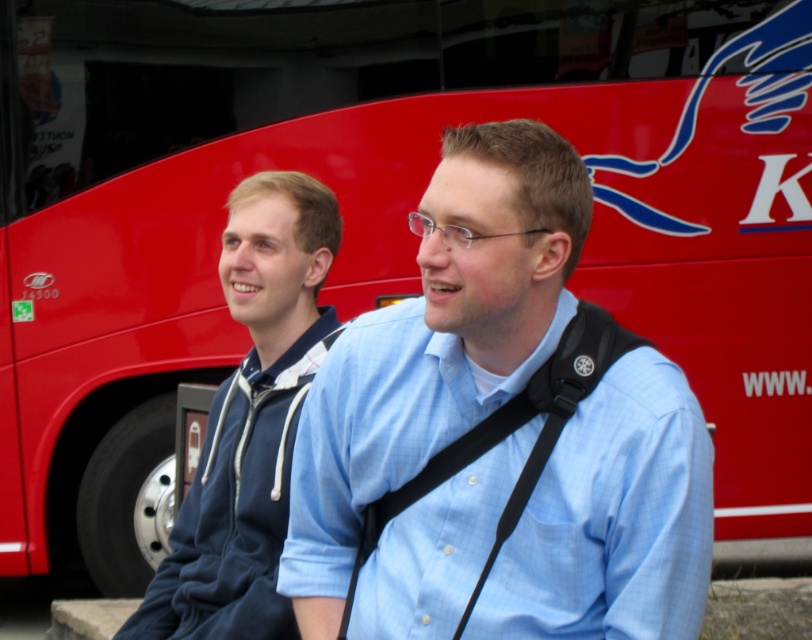
Is blue hoodie at left to the left of black fabric strap at center from the viewer's perspective?

Indeed, blue hoodie at left is positioned on the left side of black fabric strap at center.

Who is lower down, blue hoodie at left or black fabric strap at center?

black fabric strap at center

The image size is (812, 640). Identify the location of blue hoodie at left. (249, 420).

This screenshot has width=812, height=640. In order to click on blue hoodie at left in this screenshot , I will do `click(249, 420)`.

Does light blue shirt at center have a lesser width compared to black fabric strap at center?

No.

Is light blue shirt at center to the left of black fabric strap at center from the viewer's perspective?

Incorrect, light blue shirt at center is not on the left side of black fabric strap at center.

Is point (477, 208) behind point (366, 508)?

No, (477, 208) is in front of (366, 508).

You are a GUI agent. You are given a task and a screenshot of the screen. Output one action in this format:
    pyautogui.click(x=<x>, y=<y>)
    Task: Click on the light blue shirt at center
    The image size is (812, 640).
    Given the screenshot: What is the action you would take?
    pyautogui.click(x=502, y=438)

Does light blue shirt at center have a greater width compared to blue hoodie at left?

Yes, light blue shirt at center is wider than blue hoodie at left.

Between light blue shirt at center and blue hoodie at left, which one has more height?

With more height is blue hoodie at left.

The image size is (812, 640). I want to click on light blue shirt at center, so click(x=502, y=438).

Locate an element on the screen. This screenshot has height=640, width=812. light blue shirt at center is located at coordinates (502, 438).